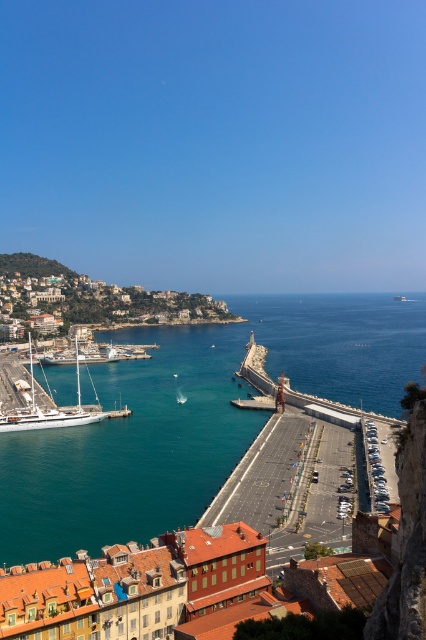
You are a tourist standing on the promenade and want to take a photo of the teal glossy water at center and the matte stone buildings at left. Which object should you focus on first to ensure both are in frame?

You should focus on the matte stone buildings at left first because the teal glossy water at center is positioned under them, so adjusting the camera to include the buildings will naturally capture the water below.

From the picture: You are standing at the viewpoint overlooking the harbor and see two points marked in the image. Which point, point (20, 273) or point (78, 388), is closer to your current position?

Point (20, 273) is further to the camera than point (78, 388). Therefore, point (78, 388) is closer to your current position.

You are standing on the promenade and want to take a photo of the blue water at center and the matte stone buildings at left. Which object should you position closer to the camera to include both in the frame?

You should position the blue water at center closer to the camera since it is in front of the matte stone buildings at left, allowing both to be captured in the same frame by focusing on the foreground object.